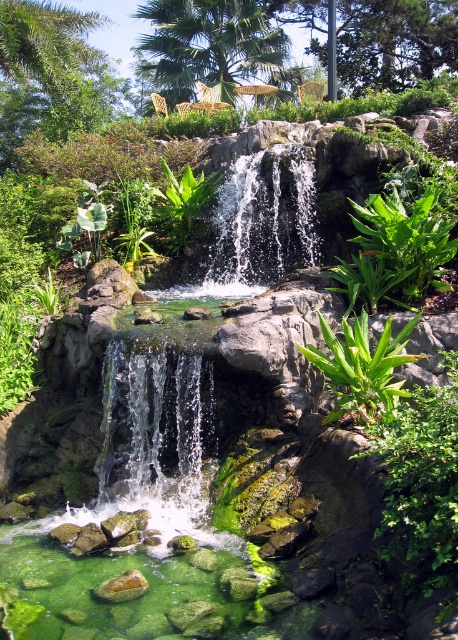
Looking at this image, is the position of clear water cascade at center more distant than that of green leafy plant at center?

Yes, clear water cascade at center is behind green leafy plant at center.

Image resolution: width=458 pixels, height=640 pixels. What do you see at coordinates (154, 428) in the screenshot?
I see `clear water cascade at center` at bounding box center [154, 428].

I want to click on clear water cascade at center, so click(154, 428).

Does clear water cascade at center have a lesser width compared to clear glass waterfall at center?

Yes.

Between point (110, 356) and point (299, 147), which one is positioned behind?

Point (299, 147)

The width and height of the screenshot is (458, 640). What are the coordinates of `clear water cascade at center` in the screenshot? It's located at (154, 428).

Between point (268, 188) and point (372, 404), which one is positioned behind?

The point (268, 188) is behind.

Looking at this image, who is higher up, clear glass waterfall at center or green leafy plant at center?

Positioned higher is clear glass waterfall at center.

The image size is (458, 640). I want to click on clear glass waterfall at center, so click(x=263, y=218).